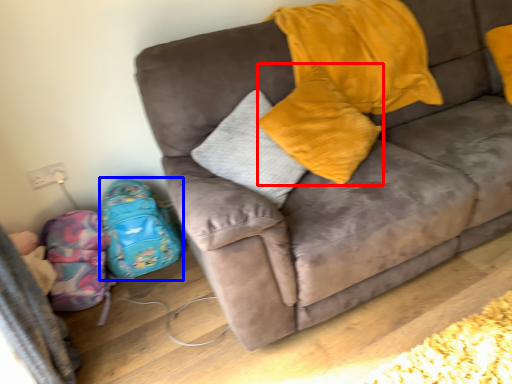
Question: Which object appears closest to the camera in this image, pillow (highlighted by a red box) or luggage (highlighted by a blue box)?

Choices:
 (A) pillow
 (B) luggage

Answer: (A)